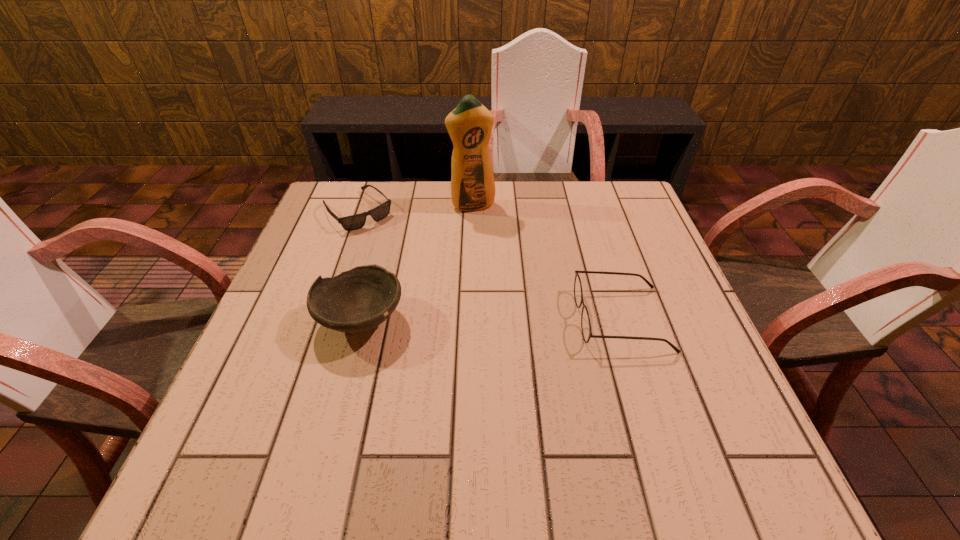
Image resolution: width=960 pixels, height=540 pixels. In order to click on object present at the right edge in this screenshot , I will do `click(578, 293)`.

Find the location of a particular element. This screenshot has width=960, height=540. object that is at the far left corner is located at coordinates (353, 222).

The image size is (960, 540). I want to click on blank space at the far edge of the desktop, so click(411, 226).

Locate an element on the screen. Image resolution: width=960 pixels, height=540 pixels. vacant space at the near edge of the desktop is located at coordinates (477, 400).

You are a GUI agent. You are given a task and a screenshot of the screen. Output one action in this format:
    pyautogui.click(x=<x>, y=<y>)
    Task: Click on the free space at the left edge of the desktop
    This screenshot has height=540, width=960.
    Given the screenshot: What is the action you would take?
    pyautogui.click(x=329, y=345)

Find the location of `vacant area at the right edge`. vacant area at the right edge is located at coordinates (645, 250).

Where is `free space at the near left corner of the desktop`? This screenshot has width=960, height=540. free space at the near left corner of the desktop is located at coordinates (235, 418).

In the image, there is a desktop. Where is `vacant space at the far right corner`? Image resolution: width=960 pixels, height=540 pixels. vacant space at the far right corner is located at coordinates (599, 221).

Identify the location of free point between the tallest object and the third shortest object. (417, 263).

You are a GUI agent. You are given a task and a screenshot of the screen. Output one action in this format:
    pyautogui.click(x=<x>, y=<y>)
    Task: Click on the free space between the sunglasses and the tallest object
    This screenshot has height=540, width=960.
    Given the screenshot: What is the action you would take?
    pyautogui.click(x=415, y=208)